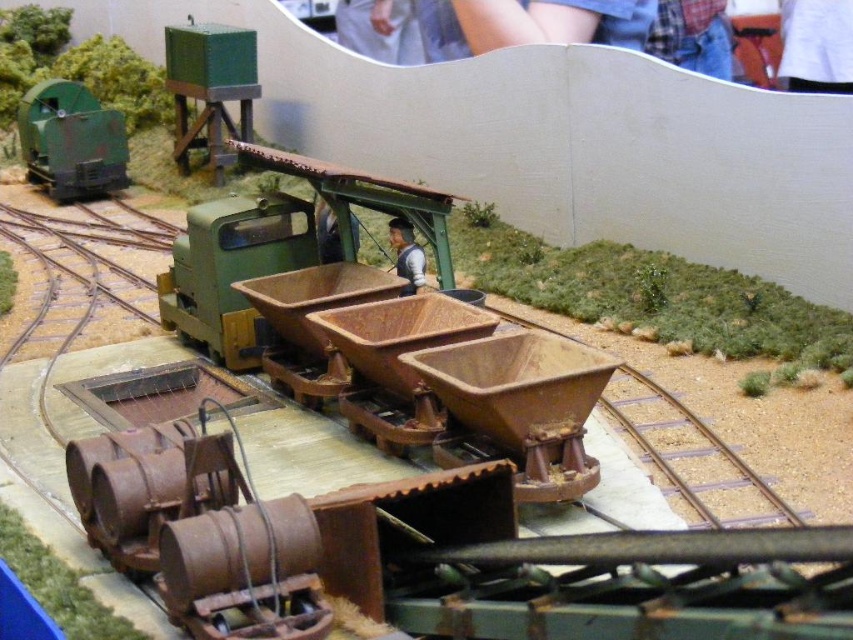
Between rusty metal train track at center and matte green train at left, which one appears on the right side from the viewer's perspective?

rusty metal train track at center is more to the right.

Does rusty metal train track at center have a lesser width compared to matte green train at left?

Yes.

This screenshot has width=853, height=640. What do you see at coordinates (450, 520) in the screenshot? I see `rusty metal train track at center` at bounding box center [450, 520].

Where is `rusty metal train track at center`? The width and height of the screenshot is (853, 640). rusty metal train track at center is located at coordinates (450, 520).